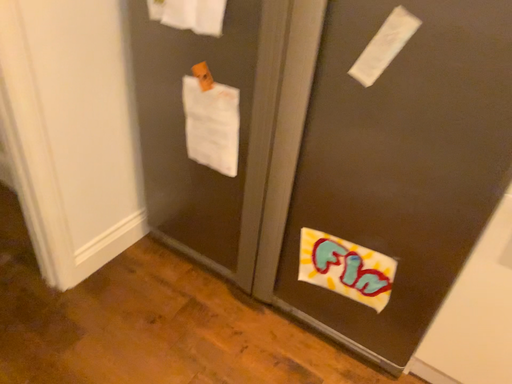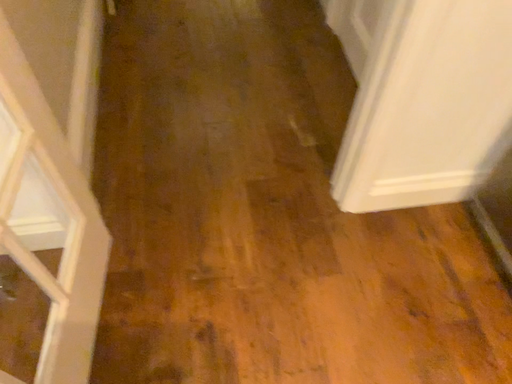
Question: Which way did the camera rotate in the video?

Choices:
 (A) rotated left
 (B) rotated right

Answer: (A)